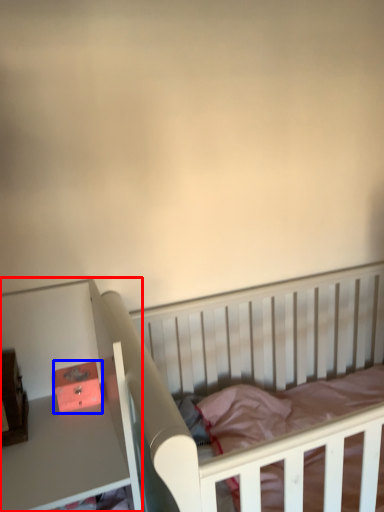
Question: Which object appears closest to the camera in this image, table (highlighted by a red box) or box (highlighted by a blue box)?

Choices:
 (A) table
 (B) box

Answer: (A)